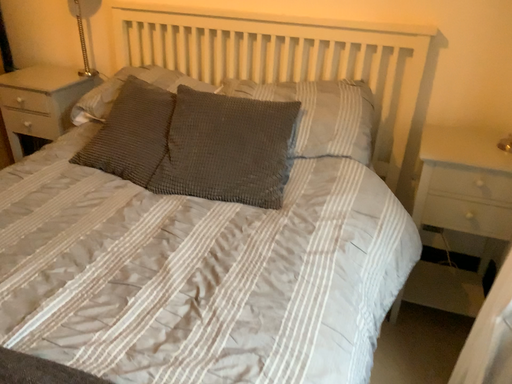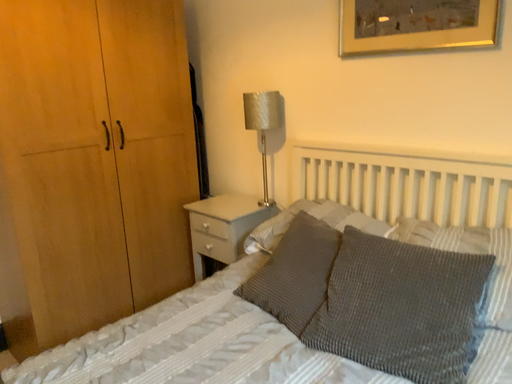
Question: Which way did the camera rotate in the video?

Choices:
 (A) rotated left
 (B) rotated right

Answer: (A)